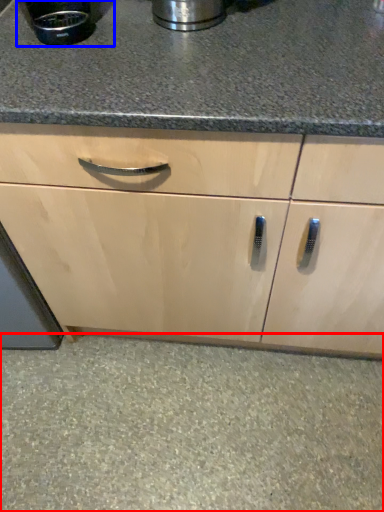
Question: Which of the following is the farthest to the observer, granite (highlighted by a red box) or appliance (highlighted by a blue box)?

Choices:
 (A) granite
 (B) appliance

Answer: (A)